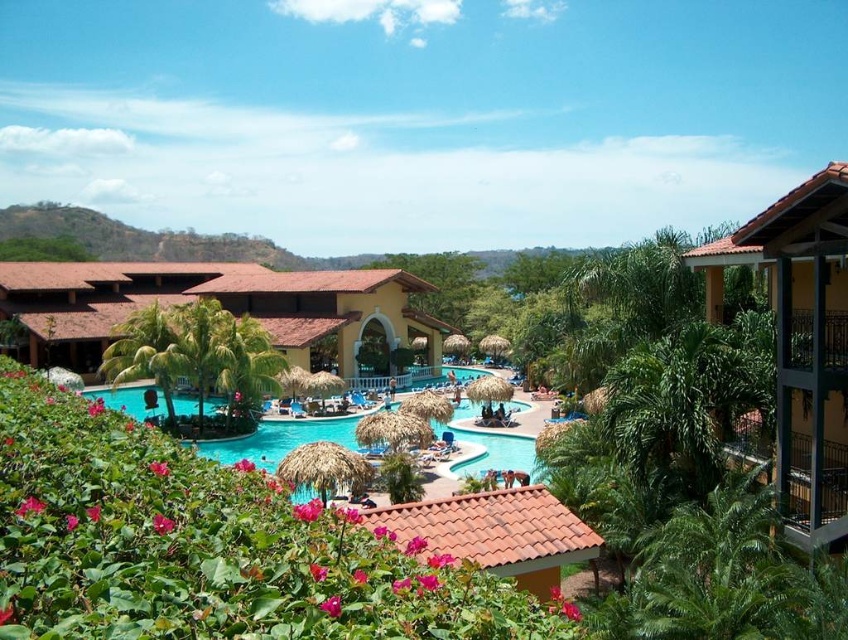
Question: Is yellow stucco balcony at upper right to the right of turquoise glossy water at center from the viewer's perspective?

Choices:
 (A) no
 (B) yes

Answer: (B)

Question: Which point appears closest to the camera in this image?

Choices:
 (A) (123, 260)
 (B) (823, 368)

Answer: (B)

Question: Is matte yellow building at center thinner than yellow stucco balcony at upper right?

Choices:
 (A) yes
 (B) no

Answer: (B)

Question: Can you confirm if matte yellow building at center is wider than yellow stucco balcony at upper right?

Choices:
 (A) yes
 (B) no

Answer: (A)

Question: Which of the following is the closest to the observer?

Choices:
 (A) matte yellow building at center
 (B) turquoise glossy water at center
 (C) yellow stucco balcony at upper right

Answer: (C)

Question: Which is nearer to the turquoise glossy water at center?

Choices:
 (A) matte yellow building at center
 (B) yellow stucco balcony at upper right

Answer: (A)